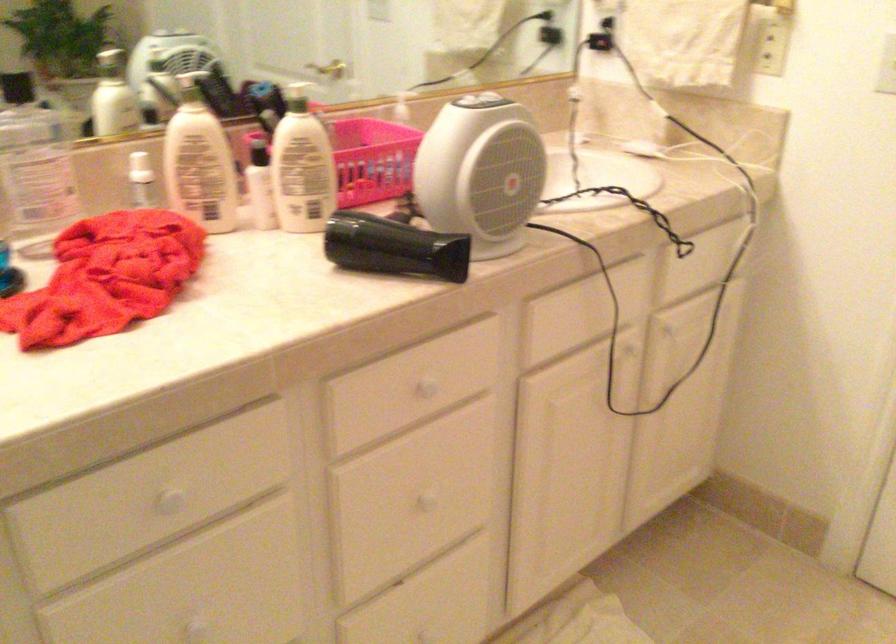
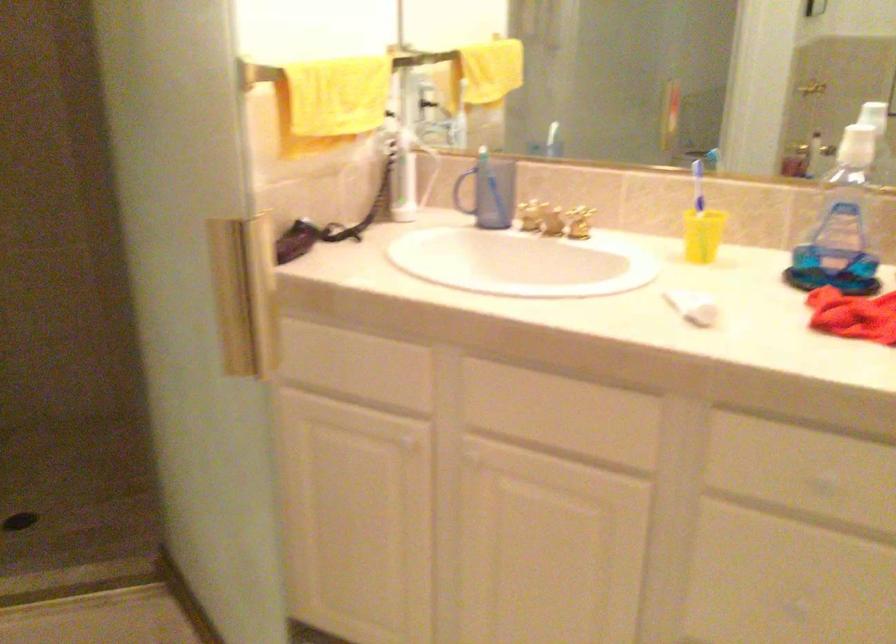
Question: The camera is either moving clockwise (left) or counter-clockwise (right) around the object. The first image is from the beginning of the video and the second image is from the end. Is the camera moving left or right when shooting the video?

Choices:
 (A) Left
 (B) Right

Answer: (B)